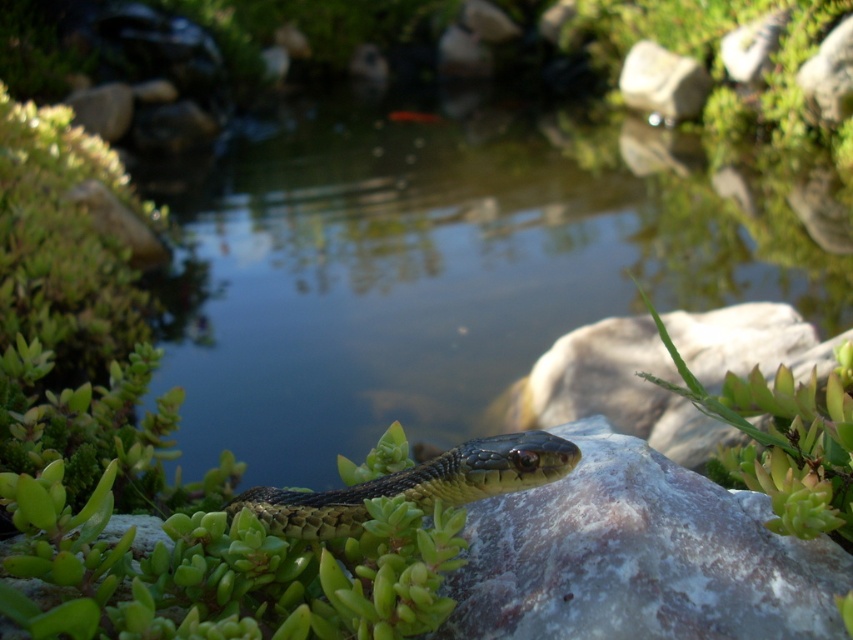
You are a frog that wants to jump from the white smooth rock at upper center to the clear water at center. Can you make the jump without touching the ground in between?

The clear water at center is wider than the white smooth rock at upper center, so yes, the frog can jump from the white smooth rock at upper center to the clear water at center without touching the ground in between.

Looking at this image, you are a hiker who wants to cross the pond by stepping on the rocks. You see the white marble rock at center and the white smooth rock at upper center. Which rock should you step on first to get closer to the opposite side?

You should step on the white marble rock at center first because it is closer to the viewer than the white smooth rock at upper center, allowing you to reach the opposite side more efficiently.

You are standing at the edge of the pond in the scene. You notice two points marked in the image. The first point is at coordinate point(495, 573) and the second is at point(664, 52). Which of these points is closer to you?

Point(495, 573) is in front of point(664, 52), so it is closer to you.